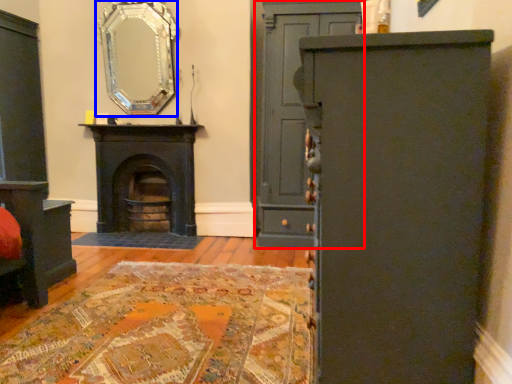
Question: Among these objects, which one is farthest to the camera, door (highlighted by a red box) or mirror (highlighted by a blue box)?

Choices:
 (A) door
 (B) mirror

Answer: (B)